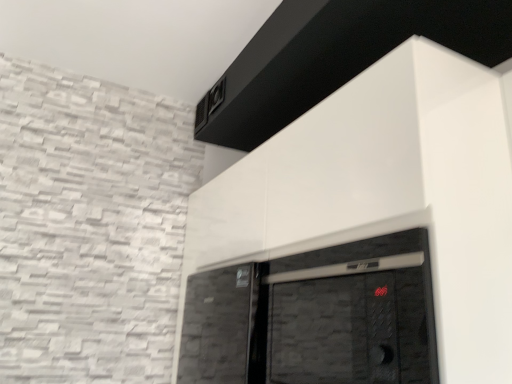
At what (x,y) coordinates should I click in order to perform the action: click on matte black oven at center. Please return your answer as a coordinate pair (x, y). Looking at the image, I should click on (316, 317).

The height and width of the screenshot is (384, 512). Describe the element at coordinates (316, 317) in the screenshot. I see `matte black oven at center` at that location.

Find the location of a particular element. matte black oven at center is located at coordinates (316, 317).